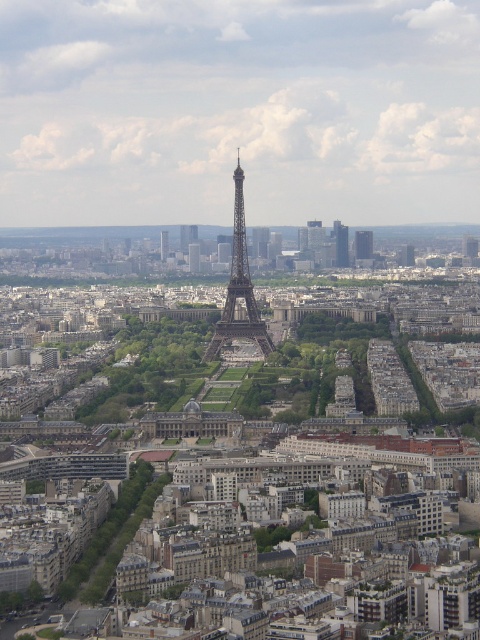
You are a tourist in Paris and want to take a photo of the glassy reflective skyscraper at center and the silver metallic tower at center. Which one appears taller in the photo?

The silver metallic tower at center appears taller in the photo because the glassy reflective skyscraper at center has a lesser height compared to it.

You are a tourist standing in Paris and want to take a photo of both the shiny metallic eiffel tower at center and the silver metallic tower at center. Which tower should you position yourself to the left of to capture both in the frame?

You should position yourself to the left of the silver metallic tower at center because the shiny metallic eiffel tower at center is to the right of it, allowing both to be captured in the frame.

Based on the aerial view of Paris, where is the glassy skyscraper at center right located in terms of coordinates?

The glassy skyscraper at center right is located at coordinates point (340, 243).